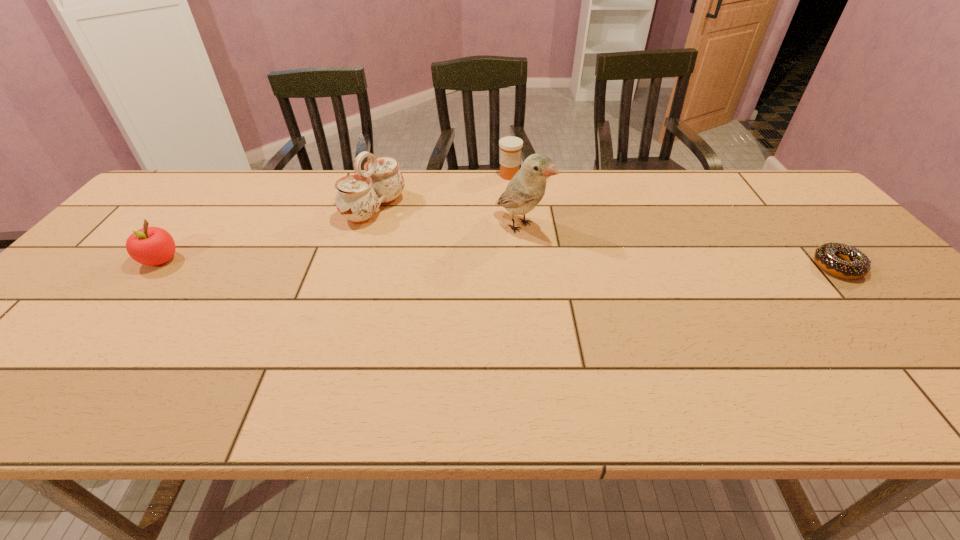
The height and width of the screenshot is (540, 960). What are the coordinates of `vacant area between the farthest object and the chinaware` in the screenshot? It's located at coord(442,192).

Locate an element on the screen. The image size is (960, 540). free space that is in between the leftmost object and the medicine is located at coordinates (335, 218).

Where is `empty location between the second object from left to right and the farthest object`? Image resolution: width=960 pixels, height=540 pixels. empty location between the second object from left to right and the farthest object is located at coordinates (442, 192).

Locate an element on the screen. The width and height of the screenshot is (960, 540). vacant space in between the leftmost object and the farthest object is located at coordinates (335, 218).

Find the location of `vacant area between the fourth object from right to left and the bird`. vacant area between the fourth object from right to left and the bird is located at coordinates (447, 218).

Where is `vacant space in between the bird and the doughnut`? This screenshot has width=960, height=540. vacant space in between the bird and the doughnut is located at coordinates coord(679,247).

Locate an element on the screen. Image resolution: width=960 pixels, height=540 pixels. free space between the leftmost object and the doughnut is located at coordinates (499, 264).

The width and height of the screenshot is (960, 540). I want to click on vacant space that's between the medicine and the second object from left to right, so click(x=442, y=192).

This screenshot has height=540, width=960. Identify the location of object that is the closest to the leftmost object. (358, 197).

Where is `the third closest object to the rightmost object`? This screenshot has width=960, height=540. the third closest object to the rightmost object is located at coordinates (358, 197).